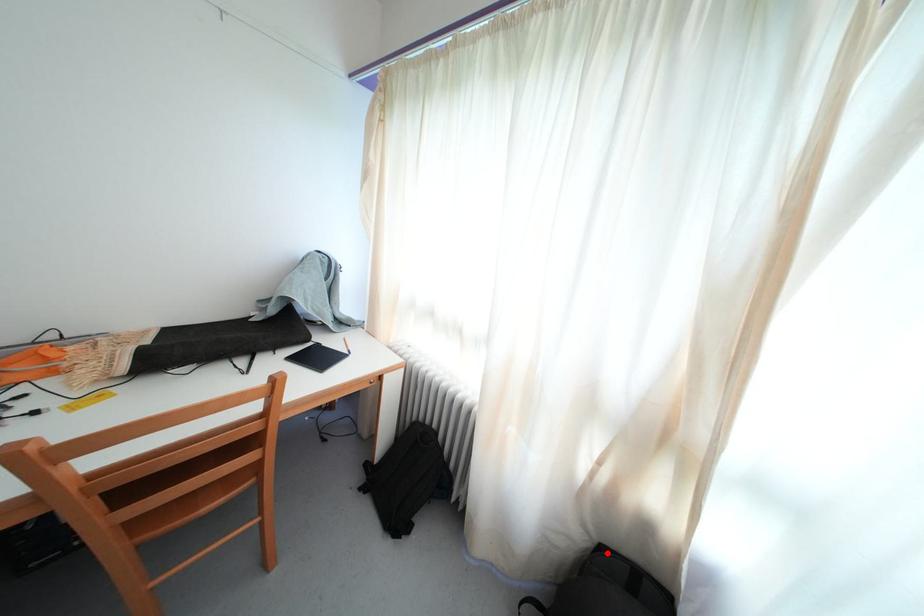
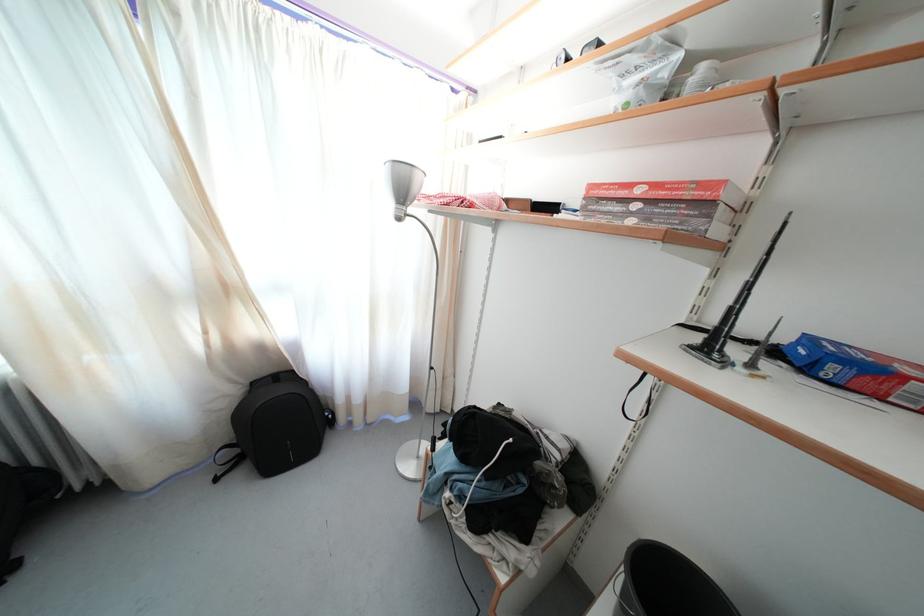
Question: I am providing you with two images of the same scene from different viewpoints. In image1, a red point is highlighted. Considering the same 3D point in image2, which of the following is correct?

Choices:
 (A) It is closer
 (B) It is farther

Answer: (B)